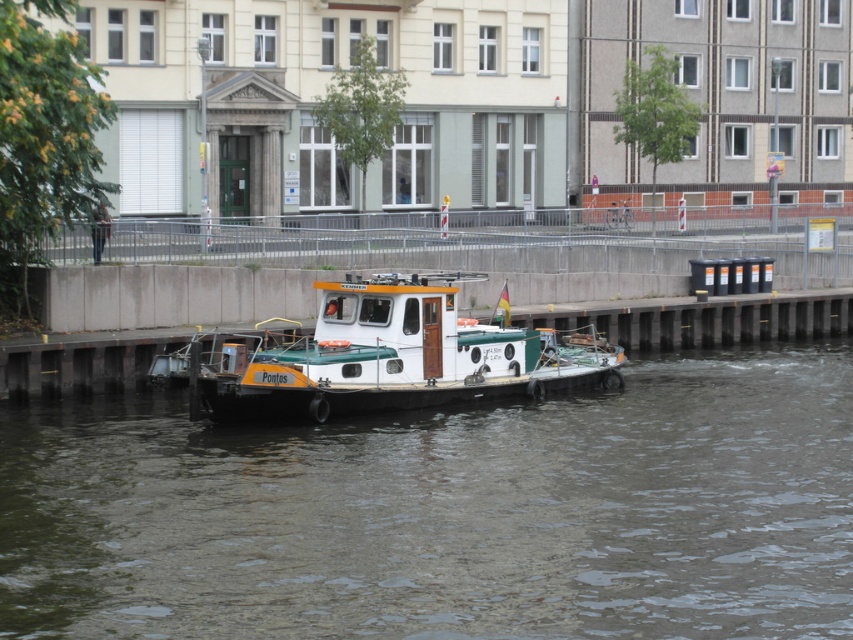
Which is in front, point (403, 572) or point (525, 364)?

Positioned in front is point (403, 572).

Does greenish-gray water at center have a larger size compared to white matte boat at center?

Correct, greenish-gray water at center is larger in size than white matte boat at center.

Does point (612, 573) come closer to viewer compared to point (450, 323)?

Yes, point (612, 573) is closer to viewer.

You are a GUI agent. You are given a task and a screenshot of the screen. Output one action in this format:
    pyautogui.click(x=<x>, y=<y>)
    Task: Click on the greenish-gray water at center
    This screenshot has width=853, height=640.
    Given the screenshot: What is the action you would take?
    pyautogui.click(x=445, y=513)